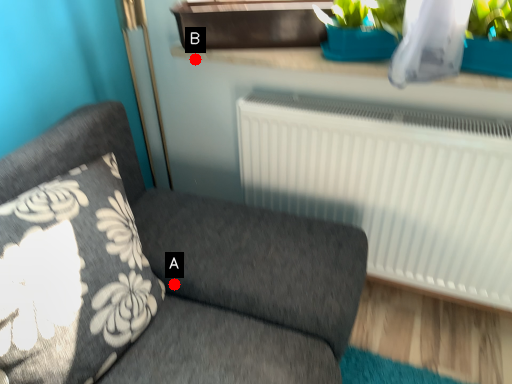
Question: Two points are circled on the image, labeled by A and B beside each circle. Which point is closer to the camera taking this photo?

Choices:
 (A) A is closer
 (B) B is closer

Answer: (A)